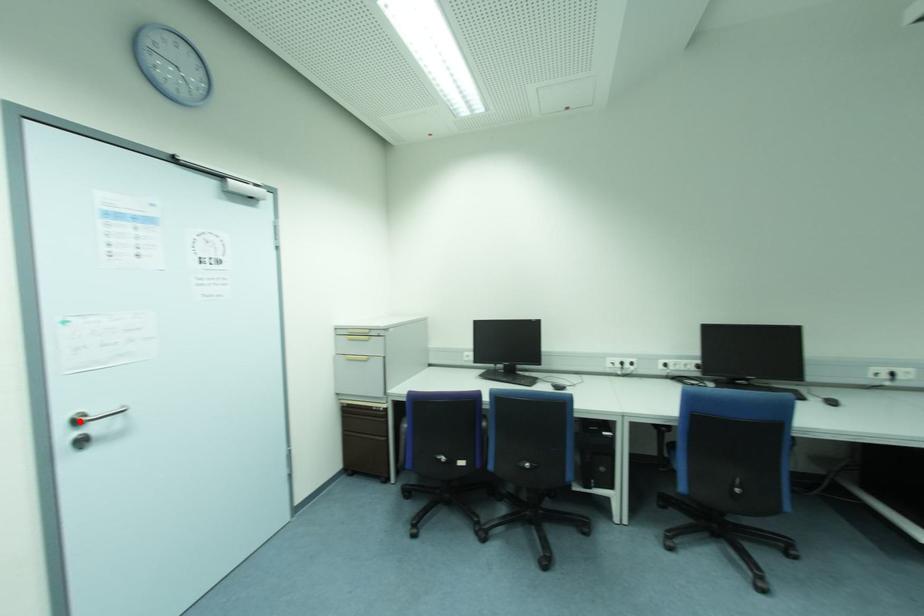
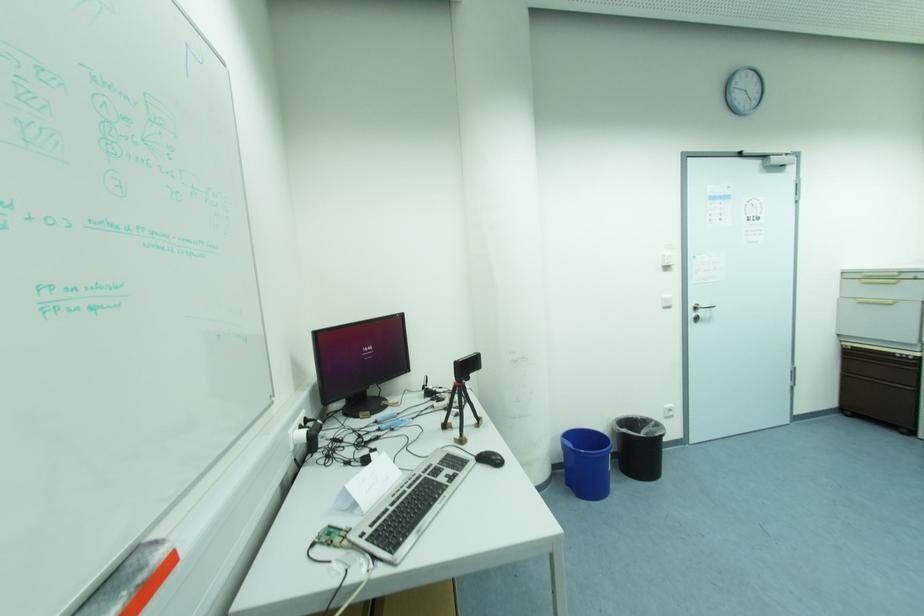
Question: I am providing you with two images of the same scene from different viewpoints. A red point is marked on the first image. Is the red point's position out of view in image 2?

Choices:
 (A) Yes
 (B) No

Answer: (B)